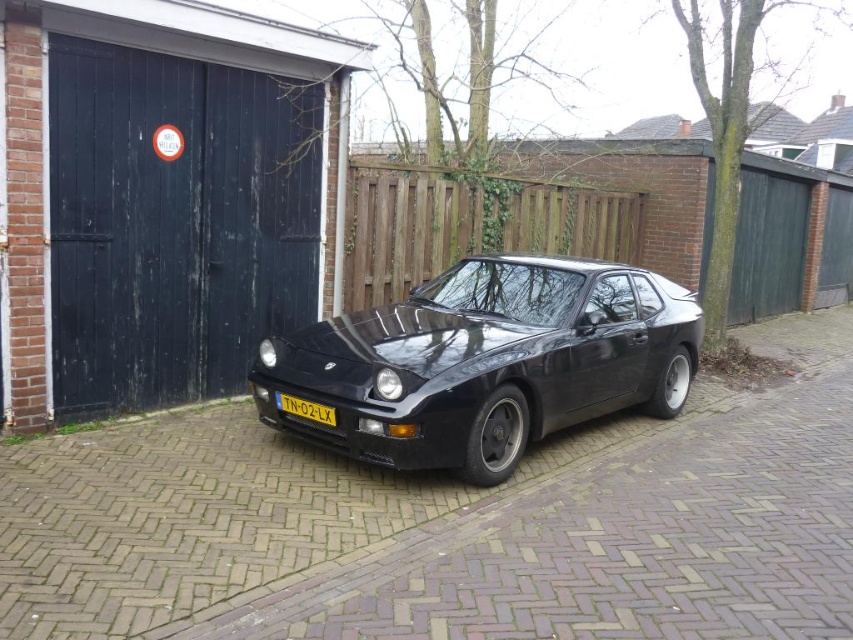
Question: Does glossy black car at center have a greater width compared to yellow matte license plate at center?

Choices:
 (A) no
 (B) yes

Answer: (B)

Question: Which point is farther to the camera?

Choices:
 (A) black wood/glass garage door at left
 (B) glossy black car at center

Answer: (A)

Question: Which point is farther to the camera?

Choices:
 (A) black wood/glass garage door at left
 (B) glossy black car at center
 (C) yellow matte license plate at center

Answer: (A)

Question: Does glossy black car at center appear over yellow matte license plate at center?

Choices:
 (A) yes
 (B) no

Answer: (A)

Question: Which object is positioned farthest from the glossy black car at center?

Choices:
 (A) black wood/glass garage door at left
 (B) yellow matte license plate at center

Answer: (A)

Question: Does black wood/glass garage door at left lie in front of glossy black car at center?

Choices:
 (A) no
 (B) yes

Answer: (A)